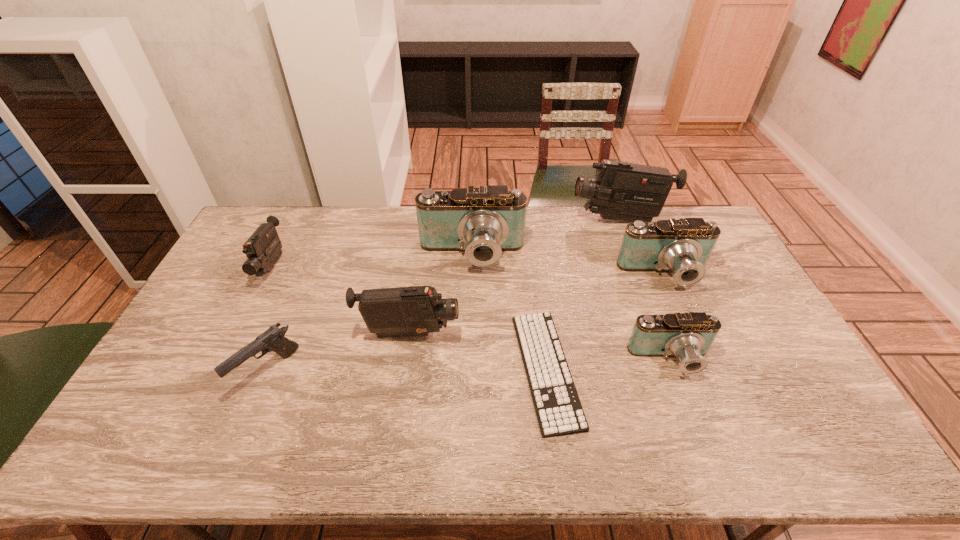
Where is `vacant space located at the muzzle of the second object from left to right`? This screenshot has height=540, width=960. vacant space located at the muzzle of the second object from left to right is located at coordinates (237, 443).

The width and height of the screenshot is (960, 540). Identify the location of vacant space located on the left of the computer keyboard. (399, 369).

Where is `object that is at the near edge`? object that is at the near edge is located at coordinates point(559,412).

At what (x,y) coordinates should I click in order to perform the action: click on object positioned at the left edge. Please return your answer as a coordinate pair (x, y). This screenshot has width=960, height=540. Looking at the image, I should click on (263, 248).

The image size is (960, 540). Identify the location of object situated at the far left corner. (263, 248).

You are a GUI agent. You are given a task and a screenshot of the screen. Output one action in this format:
    pyautogui.click(x=<x>, y=<y>)
    Task: Click on the object located at the far right corner
    The image size is (960, 540).
    Given the screenshot: What is the action you would take?
    pyautogui.click(x=624, y=191)

Identify the location of vacant space at the far edge of the desktop. (587, 226).

Identify the location of free space at the near edge of the desktop. (731, 463).

At what (x,y) coordinates should I click in order to perform the action: click on free spot at the left edge of the desktop. Please return your answer as a coordinate pair (x, y). Looking at the image, I should click on (182, 403).

Where is `vacant space at the right edge of the desktop`? Image resolution: width=960 pixels, height=540 pixels. vacant space at the right edge of the desktop is located at coordinates (777, 355).